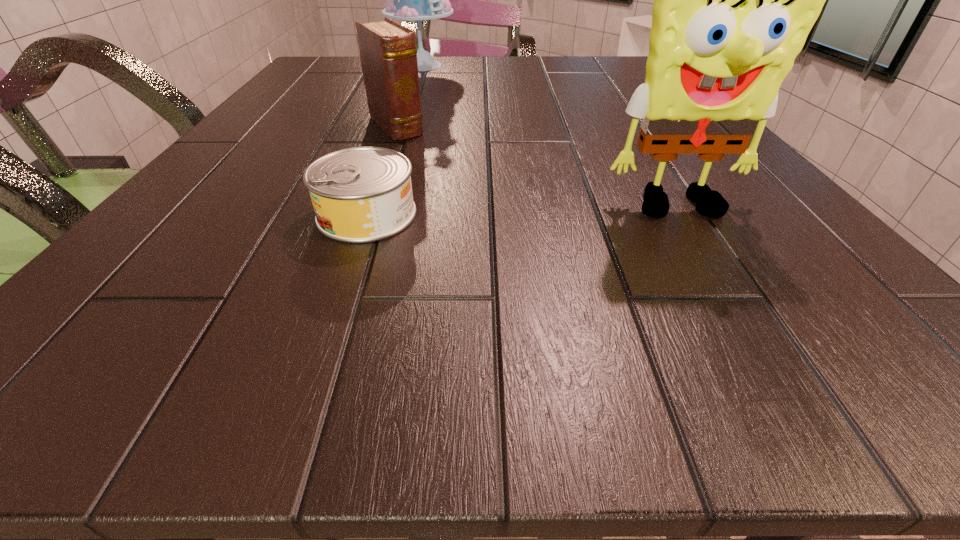
At what (x,y) coordinates should I click in order to perform the action: click on free space at the right edge of the desktop. Please return your answer as a coordinate pair (x, y). The height and width of the screenshot is (540, 960). Looking at the image, I should click on (708, 221).

Locate an element on the screen. The height and width of the screenshot is (540, 960). vacant area at the far left corner is located at coordinates (339, 69).

Locate an element on the screen. This screenshot has width=960, height=540. blank area at the near left corner is located at coordinates (205, 283).

The width and height of the screenshot is (960, 540). Identify the location of vacant space at the far right corner of the desktop. (642, 59).

This screenshot has height=540, width=960. I want to click on free spot between the third shortest object and the cake, so click(x=552, y=138).

At what (x,y) coordinates should I click in order to perform the action: click on vacant space that is in between the second tallest object and the second farthest object. Please return your answer as a coordinate pair (x, y). Looking at the image, I should click on (539, 168).

Find the location of `free area in between the sponge and the cake`. free area in between the sponge and the cake is located at coordinates (552, 138).

Select which object is the third closest to the farthest object. Please provide its 2D coordinates. Your answer should be formatted as a tuple, i.e. [(x, y)], where the tuple contains the x and y coordinates of a point satisfying the conditions above.

[(734, 0)]

Identify the location of object that can be found as the closest to the can. (388, 53).